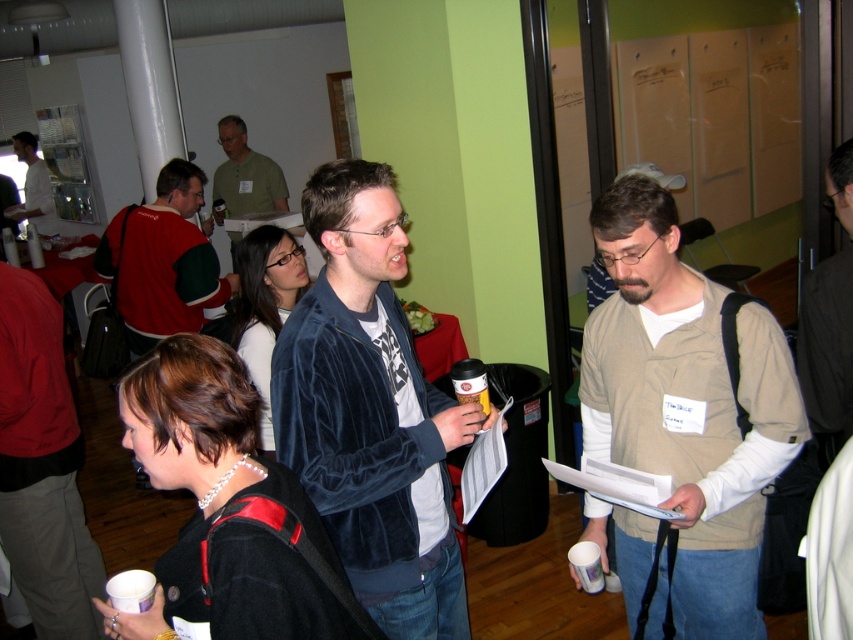
Who is more distant from viewer, (384, 536) or (235, 208)?

The point (235, 208) is more distant.

Find the location of `velvet blue jacket at center`. velvet blue jacket at center is located at coordinates (370, 412).

Does point (695, 387) come in front of point (216, 179)?

Yes, it is in front of point (216, 179).

Is beige cotton vest at center bigger than matte green shirt at center?

No, beige cotton vest at center is not bigger than matte green shirt at center.

What do you see at coordinates (688, 404) in the screenshot?
I see `beige cotton vest at center` at bounding box center [688, 404].

Identify the location of beige cotton vest at center. The image size is (853, 640). (688, 404).

Which is above, velvet blue jacket at center or velvet jacket at center?

velvet jacket at center

Does velvet blue jacket at center have a larger size compared to velvet jacket at center?

Incorrect, velvet blue jacket at center is not larger than velvet jacket at center.

Describe the element at coordinates (370, 412) in the screenshot. I see `velvet blue jacket at center` at that location.

Where is `velvet blue jacket at center`? This screenshot has height=640, width=853. velvet blue jacket at center is located at coordinates (370, 412).